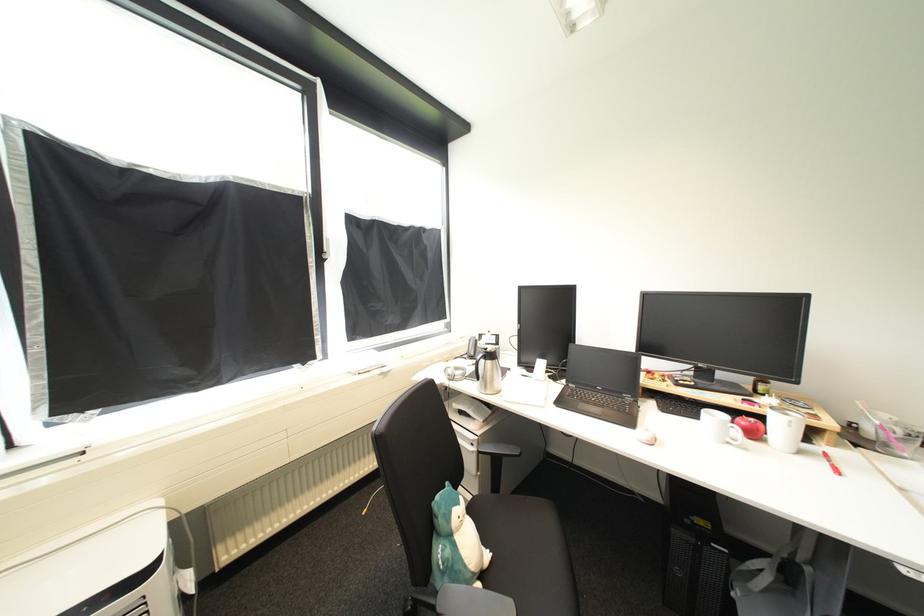
This screenshot has height=616, width=924. Find the location of `blue plush toy`. blue plush toy is located at coordinates (455, 541).